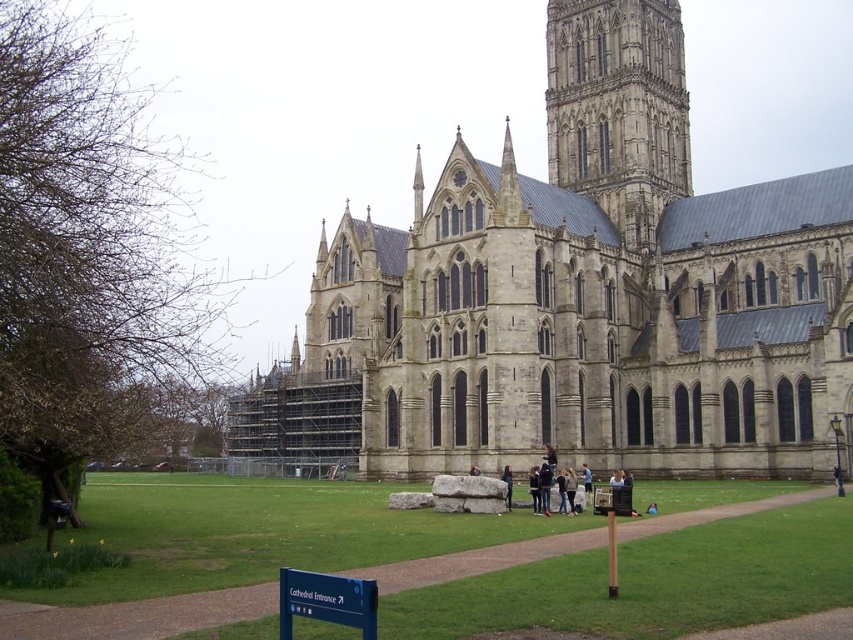
Question: Which is farther from the green grass at center?

Choices:
 (A) stone church at center
 (B) dark blue fabric jacket at center
 (C) stone gothic tower at center

Answer: (C)

Question: Which is nearer to the green grass at center?

Choices:
 (A) stone church at center
 (B) dark blue fabric jacket at center
 (C) stone gothic tower at center

Answer: (B)

Question: Which of the following is the farthest from the observer?

Choices:
 (A) stone gothic tower at center
 (B) dark blue fabric jacket at center
 (C) stone church at center
 (D) green grass at center

Answer: (A)

Question: Is green grass at center thinner than dark blue fabric jacket at center?

Choices:
 (A) yes
 (B) no

Answer: (B)

Question: Does stone church at center come in front of dark blue fabric jacket at center?

Choices:
 (A) no
 (B) yes

Answer: (A)

Question: Can you confirm if stone church at center is positioned above dark blue fabric jacket at center?

Choices:
 (A) no
 (B) yes

Answer: (B)